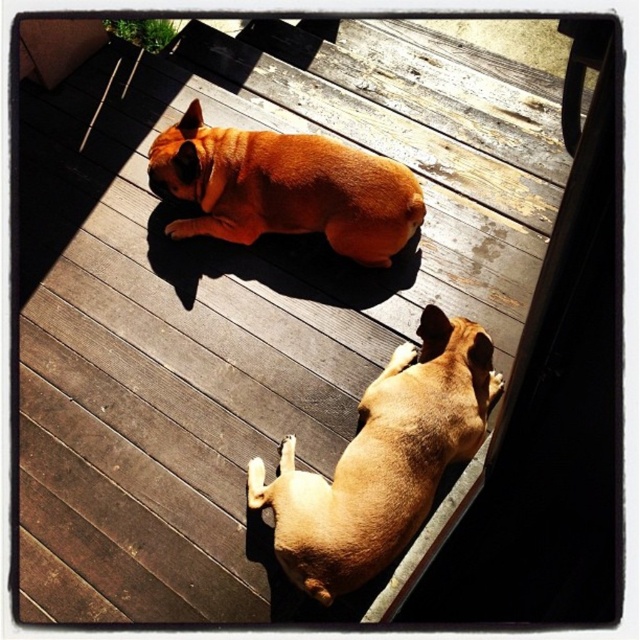
You are standing on the wooden deck and want to place a small treat between the two points marked as point [416,376] and point [164,161]. Which point should you move towards to ensure the treat is closer to the dog in the foreground?

Point [416,376] is closer to the viewer than point [164,161]. Therefore, you should move towards point [416,376] to place the treat closer to the dog in the foreground.

You are a photographer trying to capture both dogs in the image. Since the light brown fur at lower right and matte orange dog at center are different in size, which dog should you focus on first to ensure both fit in the frame?

The light brown fur at lower right is bigger than the matte orange dog at center, so you should focus on the light brown fur at lower right first to ensure both fit in the frame.